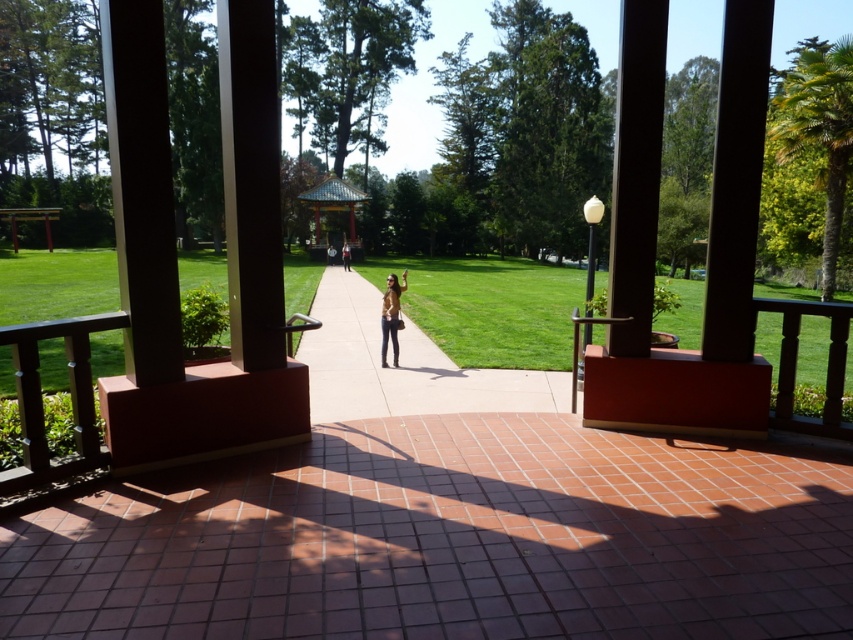
You are a gardener who needs to transport a large gardening cart that is 2 meters wide. You are standing on the smooth concrete sidewalk at center and want to go to the multicolored tiled gazebo at center. Can your cart fit through the path between them?

The smooth concrete sidewalk at center is wider than the multicolored tiled gazebo at center, so the cart may not fit through the narrower part near the gazebo. Check the exact measurements before proceeding.

You are standing on the porch and want to place a new bench exactly between the multicolored tiled gazebo at center and the leather jacket at center. Which object should the bench be closer to?

The bench should be placed closer to the leather jacket at center because the multicolored tiled gazebo at center is to the left of the leather jacket at center, so the midpoint between them would be closer to the right side where the leather jacket is located.

You are standing on the porch and want to pick up the matte brown jacket at center. Which object is closer to you when you step off the porch onto the smooth concrete sidewalk at center?

The smooth concrete sidewalk at center is closer to the viewer than the matte brown jacket at center, so when you step onto it, the jacket is further away and you would need to walk forward to reach it.